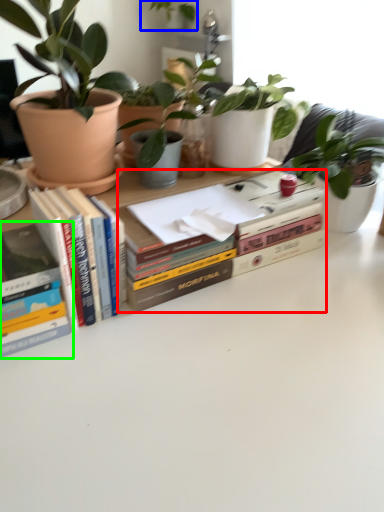
Question: Considering the real-world distances, which object is closest to book (highlighted by a red box)? houseplant (highlighted by a blue box) or book (highlighted by a green box).

Choices:
 (A) houseplant
 (B) book

Answer: (B)